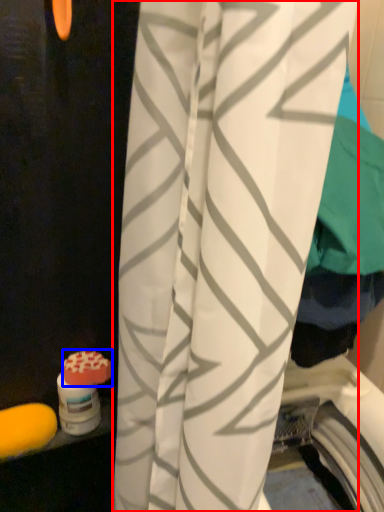
Question: Among these objects, which one is farthest to the camera, curtain (highlighted by a red box) or soap (highlighted by a blue box)?

Choices:
 (A) curtain
 (B) soap

Answer: (B)